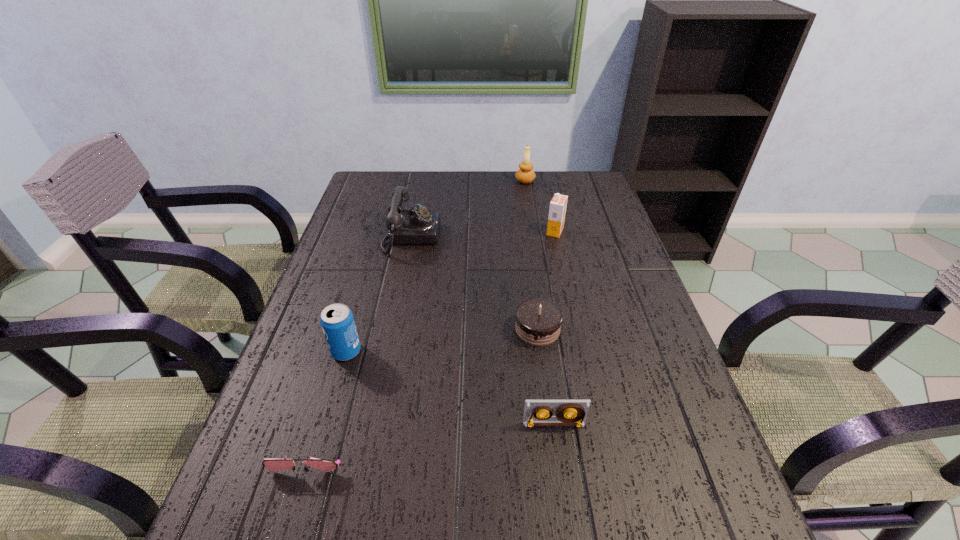
This screenshot has width=960, height=540. In order to click on vacant space that satisfies the following two spatial constraints: 1. on the back side of the soda can; 2. on the left side of the candle_holder in this screenshot , I will do `click(396, 181)`.